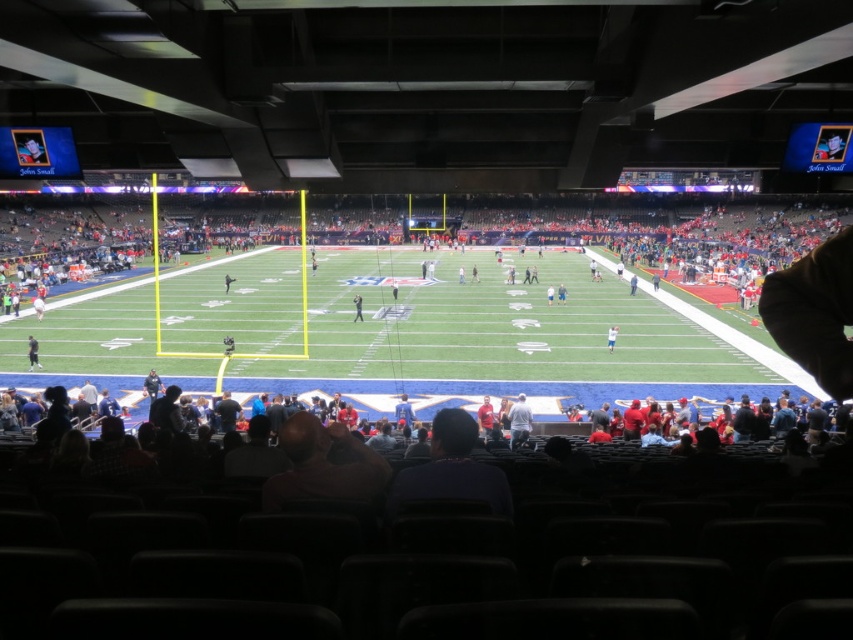
You are a photographer standing at the edge of the football field. You see the gray fabric jacket at center and the light brown leather jacket at lower left. Which jacket is nearer to you?

The gray fabric jacket at center is closer to the viewer than the light brown leather jacket at lower left.

You are a photographer trying to capture a candid shot of the dark blue shirt at center and the dark blue uniform at center. Which of the two would you focus on first if you want to ensure both are in the frame without moving the camera?

The dark blue shirt at center is thinner than the dark blue uniform at center, so focusing on the darker blue uniform at center first would allow you to frame both since it is wider and easier to lock focus on.